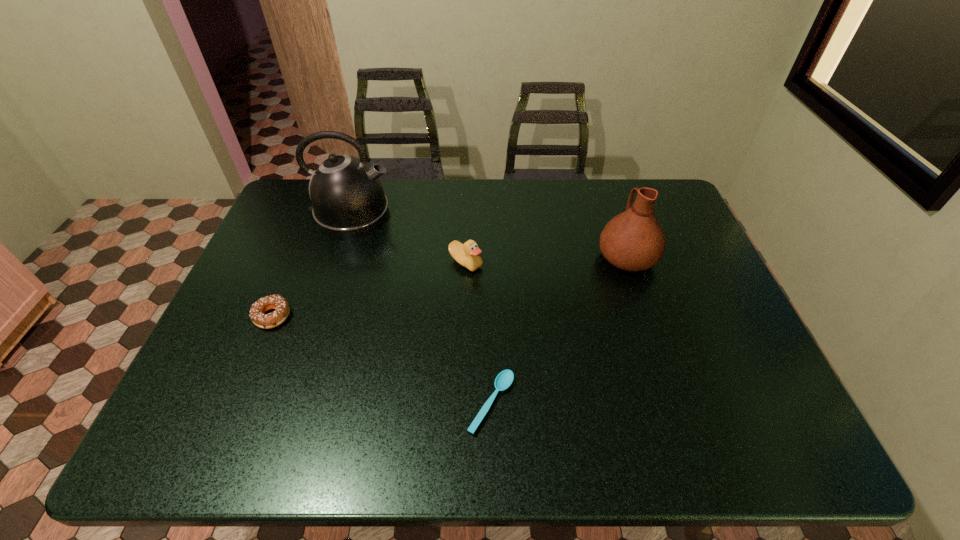
Image resolution: width=960 pixels, height=540 pixels. Find the location of `vacant space located 0.310m on the side of the pitcher with the handle`. vacant space located 0.310m on the side of the pitcher with the handle is located at coordinates (601, 179).

Locate an element on the screen. This screenshot has width=960, height=540. vacant position located on the side of the pitcher with the handle is located at coordinates (607, 198).

This screenshot has width=960, height=540. Identify the location of free space located 0.120m at the beak of the third tallest object. (465, 307).

The height and width of the screenshot is (540, 960). I want to click on free space located 0.060m on the left of the second shortest object, so click(230, 316).

I want to click on vacant region located on the left of the shortest object, so click(x=293, y=403).

Find the location of a particular element. The height and width of the screenshot is (540, 960). object that is at the far edge is located at coordinates pyautogui.click(x=347, y=196).

This screenshot has height=540, width=960. In order to click on object positioned at the near edge in this screenshot , I will do `click(504, 379)`.

At what (x,y) coordinates should I click in order to perform the action: click on kettle situated at the left edge. Please return your answer as a coordinate pair (x, y). This screenshot has width=960, height=540. Looking at the image, I should click on (347, 196).

The image size is (960, 540). Identify the location of doughnut that is at the left edge. (257, 311).

Where is `object that is at the right edge`? object that is at the right edge is located at coordinates (633, 240).